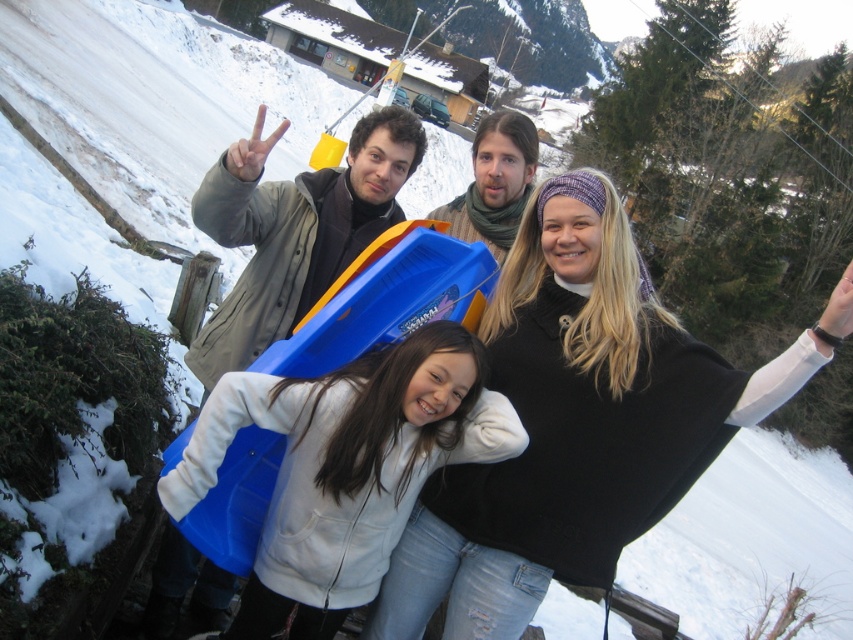
You are planning to take a photo of the blue plastic sled at center and the matte gray jacket at upper left. Which object should you focus on first if you want to capture both in the frame without moving the camera?

You should focus on the blue plastic sled at center first because it is shorter than the matte gray jacket at upper left, allowing both to fit within the frame when starting with the lower object.

You are a photographer trying to capture the blue plastic sled at center and the matte gray jacket at upper left in the same frame. Based on their positions, which object should you focus on first to ensure both are in the frame?

The blue plastic sled at center is below matte gray jacket at upper left, so you should focus on the matte gray jacket at upper left first to ensure both are in the frame.

You are standing at the center of the snowy area and want to locate the blue plastic sled at center. According to the coordinates provided, in which direction should you move to reach it?

The blue plastic sled at center is located at coordinates point (578, 422). Since you are at the center, moving towards the northeast direction would lead you to the sled.